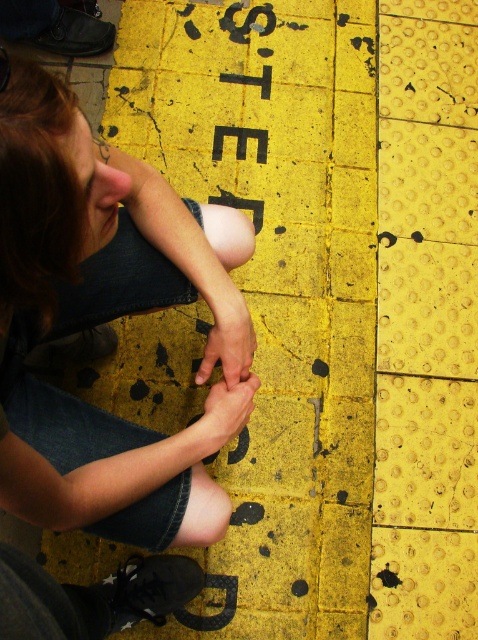
Question: Is black rubber letters at center thinner than matte skin hand at center?

Choices:
 (A) yes
 (B) no

Answer: (B)

Question: Which point appears closest to the camera in this image?

Choices:
 (A) (228, 388)
 (B) (249, 13)
 (C) (35, 228)

Answer: (C)

Question: Can you confirm if matte skin hand at center is positioned below smooth skin hand at center?

Choices:
 (A) no
 (B) yes

Answer: (A)

Question: Can you confirm if black rubber letters at center is positioned below smooth skin hand at center?

Choices:
 (A) yes
 (B) no

Answer: (B)

Question: Among these objects, which one is farthest from the camera?

Choices:
 (A) smooth skin hand at center
 (B) matte skin hand at center
 (C) black rubber letters at center
 (D) denim jeans at center

Answer: (C)

Question: Which point is closer to the camera?

Choices:
 (A) smooth skin hand at center
 (B) black rubber letters at center
 (C) denim jeans at center

Answer: (C)